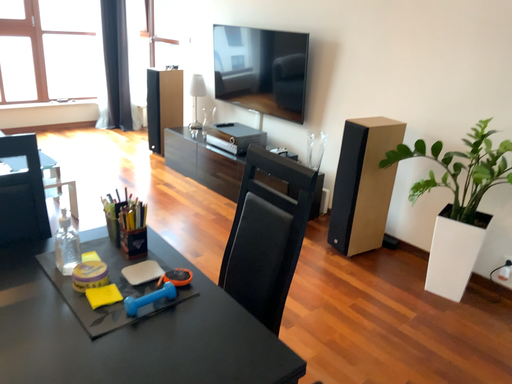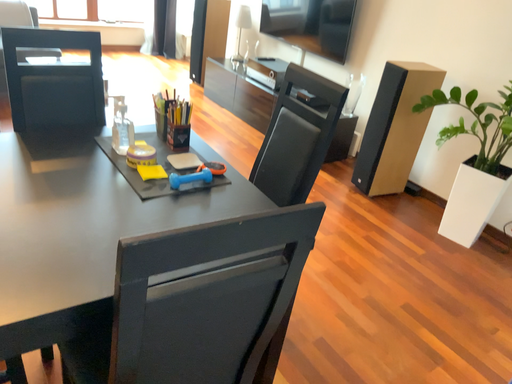
Question: How did the camera likely rotate when shooting the video?

Choices:
 (A) rotated downward
 (B) rotated upward

Answer: (A)